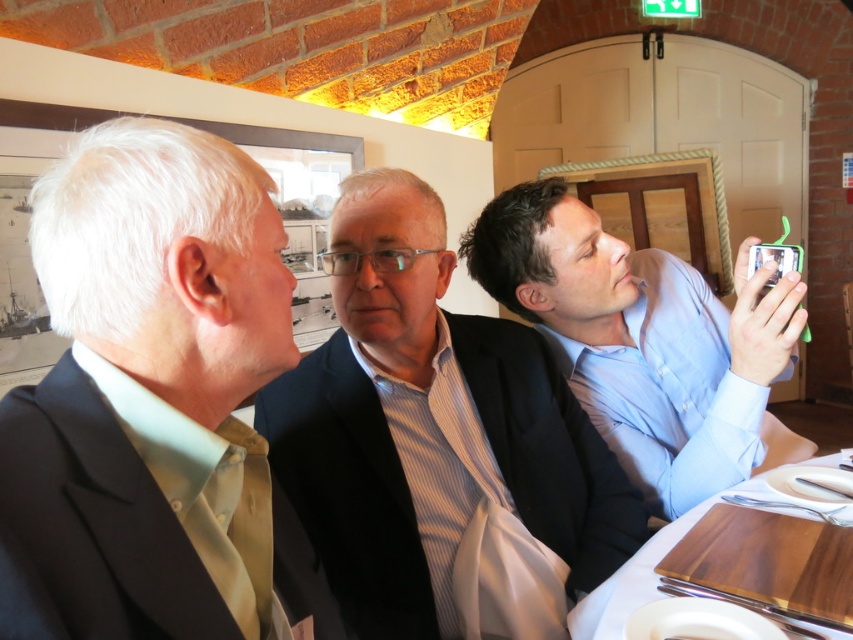
Who is more distant from viewer, (259,362) or (498,445)?

The point (498,445) is more distant.

Is point (131, 362) closer to camera compared to point (437, 362)?

Yes, it is in front of point (437, 362).

This screenshot has height=640, width=853. What are the coordinates of `light beige suit at center` in the screenshot? It's located at (154, 401).

Between dark blue suit at center and blue shirt at right, which one has more height?

dark blue suit at center is taller.

The image size is (853, 640). What are the coordinates of `dark blue suit at center` in the screenshot? It's located at (438, 444).

Where is `dark blue suit at center`? dark blue suit at center is located at coordinates (438, 444).

Does light beige suit at center have a lesser width compared to blue shirt at right?

Correct, light beige suit at center's width is less than blue shirt at right's.

Between light beige suit at center and blue shirt at right, which one appears on the right side from the viewer's perspective?

From the viewer's perspective, blue shirt at right appears more on the right side.

Find the location of a particular element. light beige suit at center is located at coordinates (154, 401).